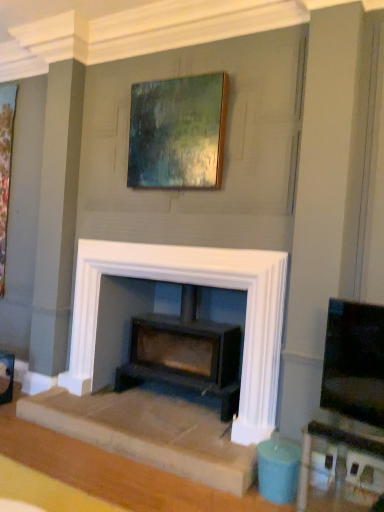
Describe the element at coordinates (336, 443) in the screenshot. The width and height of the screenshot is (384, 512). I see `matte white table at lower right` at that location.

What is the approximate width of white stone fireplace at center?

The width of white stone fireplace at center is 4.48 feet.

This screenshot has height=512, width=384. Identify the location of white stone fireplace at center. (164, 401).

This screenshot has height=512, width=384. What are the coordinates of `matte black wood burning stove at center` in the screenshot? It's located at (185, 354).

This screenshot has height=512, width=384. Find the location of `wooden frame at upper center, which ranks as the 2th picture frame in left-to-right order`. wooden frame at upper center, which ranks as the 2th picture frame in left-to-right order is located at coordinates (178, 132).

Where is `matte white table at lower right`? matte white table at lower right is located at coordinates (336, 443).

From a real-world perspective, who is located higher, matte black tv at right or matte black wood burning stove at center?

In real-world perspective, matte black tv at right is above.

Looking at their sizes, would you say matte black tv at right is wider or thinner than matte black wood burning stove at center?

In the image, matte black tv at right appears to be more narrow than matte black wood burning stove at center.

Identify the location of entertainment center that is on the right side of matte black wood burning stove at center. The image size is (384, 512). (347, 415).

Is matte black tv at right oriented away from wooden frame at upper center, positioned as the 2th picture frame in back-to-front order?

No.

From the picture: Which object is further away from the camera taking this photo, matte black tv at right or wooden frame at upper center, which is counted as the first picture frame, starting from the front?

wooden frame at upper center, which is counted as the first picture frame, starting from the front.

From a real-world perspective, is matte black tv at right over wooden frame at upper center, which ranks as the 2th picture frame in left-to-right order?

Actually, matte black tv at right is physically below wooden frame at upper center, which ranks as the 2th picture frame in left-to-right order, in the real world.

Does matte black tv at right appear on the left side of wooden frame at upper center, the 1th picture frame from the right?

In fact, matte black tv at right is to the right of wooden frame at upper center, the 1th picture frame from the right.

Does point (6, 222) appear closer or farther from the camera than point (58, 415)?

Clearly, point (6, 222) is more distant from the camera than point (58, 415).

Is wooden picture frame at left, the second picture frame in the right-to-left sequence, far away from white stone fireplace at center?

Yes, wooden picture frame at left, the second picture frame in the right-to-left sequence, is far from white stone fireplace at center.

From their relative heights in the image, would you say wooden picture frame at left, the first picture frame in the left-to-right sequence, is taller or shorter than white stone fireplace at center?

In the image, wooden picture frame at left, the first picture frame in the left-to-right sequence, appears to be taller than white stone fireplace at center.

Looking at this image, which object is positioned more to the right, wooden picture frame at left, which appears as the second picture frame when viewed from the front, or white stone fireplace at center?

white stone fireplace at center.

Which is less distant, (124,387) or (361,450)?

Point (124,387) appears to be farther away from the viewer than point (361,450).

Which of these two, matte black wood burning stove at center or matte white table at lower right, is smaller?

matte white table at lower right.

Is matte black wood burning stove at center next to matte white table at lower right?

No, matte black wood burning stove at center is not touching matte white table at lower right.

From the image's perspective, is matte black wood burning stove at center under matte white table at lower right?

Incorrect, from the image's perspective, matte black wood burning stove at center is higher than matte white table at lower right.

Between wooden frame at upper center, positioned as the 2th picture frame in back-to-front order, and matte black tv at right, which one has more height?

wooden frame at upper center, positioned as the 2th picture frame in back-to-front order.

Which object is positioned more to the left, wooden frame at upper center, positioned as the 2th picture frame in back-to-front order, or matte black tv at right?

wooden frame at upper center, positioned as the 2th picture frame in back-to-front order.

Is wooden frame at upper center, which is counted as the first picture frame, starting from the front, far away from matte black tv at right?

Absolutely, wooden frame at upper center, which is counted as the first picture frame, starting from the front, is distant from matte black tv at right.

Does point (140, 97) come in front of point (299, 502)?

That is False.

I want to click on the 2nd picture frame to the left of the matte white table at lower right, counting from the anchor's position, so click(5, 167).

Is wooden picture frame at left, the second picture frame in the right-to-left sequence, placed right next to matte white table at lower right?

No, wooden picture frame at left, the second picture frame in the right-to-left sequence, is not touching matte white table at lower right.

Does point (4, 161) appear closer or farther from the camera than point (382, 437)?

Point (4, 161) appears to be farther away from the viewer than point (382, 437).

Is wooden picture frame at left, which appears as the second picture frame when viewed from the front, spatially inside matte white table at lower right, or outside of it?

wooden picture frame at left, which appears as the second picture frame when viewed from the front, exists outside the volume of matte white table at lower right.

Does matte white table at lower right turn towards wooden picture frame at left, the first picture frame in the left-to-right sequence?

No, matte white table at lower right does not turn towards wooden picture frame at left, the first picture frame in the left-to-right sequence.

Are matte white table at lower right and wooden picture frame at left, the second picture frame in the right-to-left sequence, far apart?

Yes.

I want to click on table located on the right of wooden picture frame at left, the first picture frame in the left-to-right sequence, so click(336, 443).

The image size is (384, 512). Find the location of `wood burning stove lying on the left of matte black tv at right`. wood burning stove lying on the left of matte black tv at right is located at coordinates (185, 354).

I want to click on entertainment center below the wooden frame at upper center, the 1th picture frame from the right (from a real-world perspective), so click(x=347, y=415).

When comparing their distances from wooden frame at upper center, which is counted as the first picture frame, starting from the front, does white stone fireplace at center or matte white table at lower right seem closer?

white stone fireplace at center.

In the scene shown: Estimate the real-world distances between objects in this image. Which object is closer to matte black wood burning stove at center, matte black tv at right or wooden picture frame at left, the second picture frame in the right-to-left sequence?

matte black tv at right is closer to matte black wood burning stove at center.

Which object lies nearer to the anchor point white stone fireplace at center, matte black wood burning stove at center or matte black tv at right?

Among the two, matte black wood burning stove at center is located nearer to white stone fireplace at center.

Estimate the real-world distances between objects in this image. Which object is closer to matte black wood burning stove at center, white stone fireplace at center or wooden frame at upper center, positioned as the 2th picture frame in back-to-front order?

Based on the image, white stone fireplace at center appears to be nearer to matte black wood burning stove at center.

When comparing their distances from matte black wood burning stove at center, does wooden picture frame at left, which appears as the second picture frame when viewed from the front, or wooden frame at upper center, which is counted as the first picture frame, starting from the front, seem further?

wooden picture frame at left, which appears as the second picture frame when viewed from the front, lies further to matte black wood burning stove at center than the other object.

Looking at the image, which one is located further to matte black wood burning stove at center, matte white table at lower right or white stone fireplace at center?

Answer: matte white table at lower right is further to matte black wood burning stove at center.

Which object lies further to the anchor point matte black tv at right, wooden frame at upper center, which is counted as the first picture frame, starting from the front, or matte black wood burning stove at center?

wooden frame at upper center, which is counted as the first picture frame, starting from the front.

When comparing their distances from wooden frame at upper center, positioned as the 2th picture frame in back-to-front order, does matte black tv at right or matte white table at lower right seem further?

matte white table at lower right.

Identify the location of wood burning stove between white stone fireplace at center and matte black tv at right from left to right. (185, 354).

Locate an element on the screen. picture frame between wooden picture frame at left, the second picture frame in the right-to-left sequence, and matte white table at lower right is located at coordinates click(x=178, y=132).

Where is `fireplace between wooden frame at upper center, positioned as the 2th picture frame in back-to-front order, and matte white table at lower right in the up-down direction`? fireplace between wooden frame at upper center, positioned as the 2th picture frame in back-to-front order, and matte white table at lower right in the up-down direction is located at coordinates (164, 401).

I want to click on table between wooden picture frame at left, which appears as the first picture frame when viewed from the back, and matte black tv at right, so click(x=336, y=443).